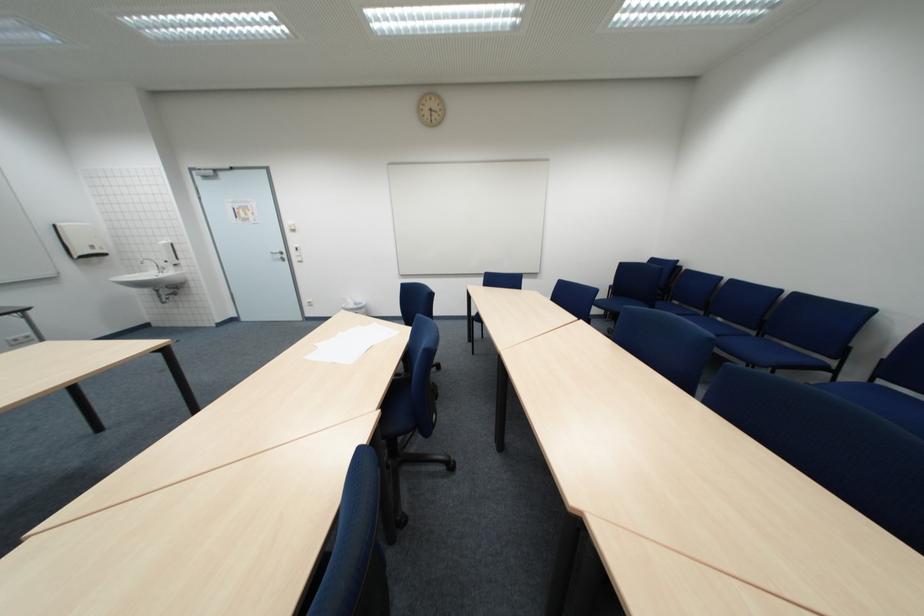
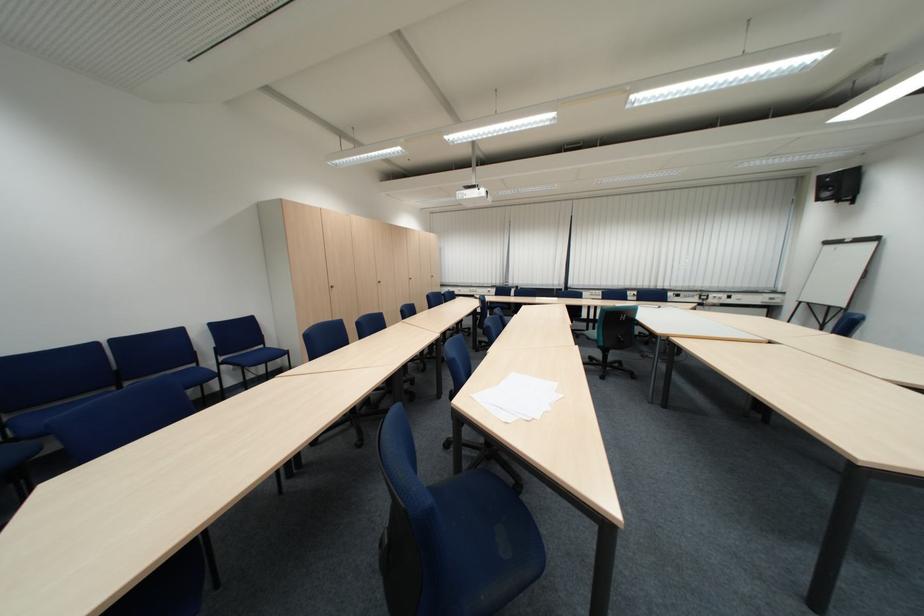
Find the pixel in the second image that matches the point at 896,383 in the first image.

(235, 360)